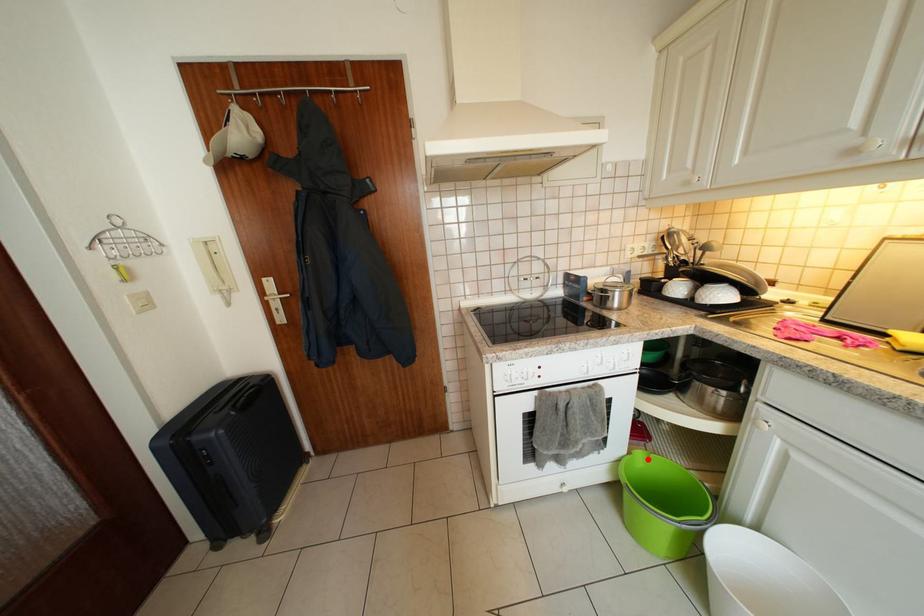
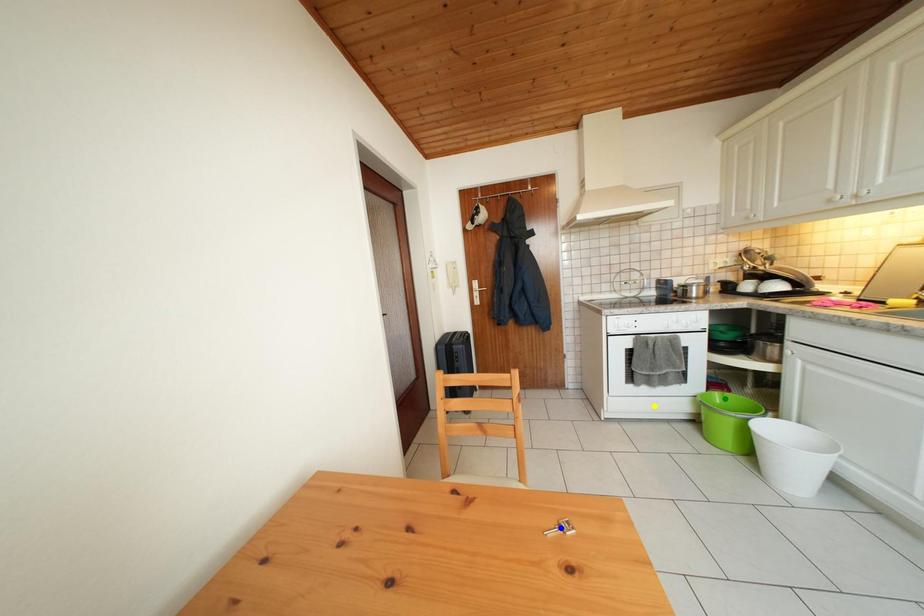
Question: I am providing you with two images of the same scene from different viewpoints. A red point is marked on the first image. You are given multiple points on the second image. Which mark in image 2 goes with the point in image 1?

Choices:
 (A) yellow point
 (B) blue point
 (C) green point

Answer: (C)